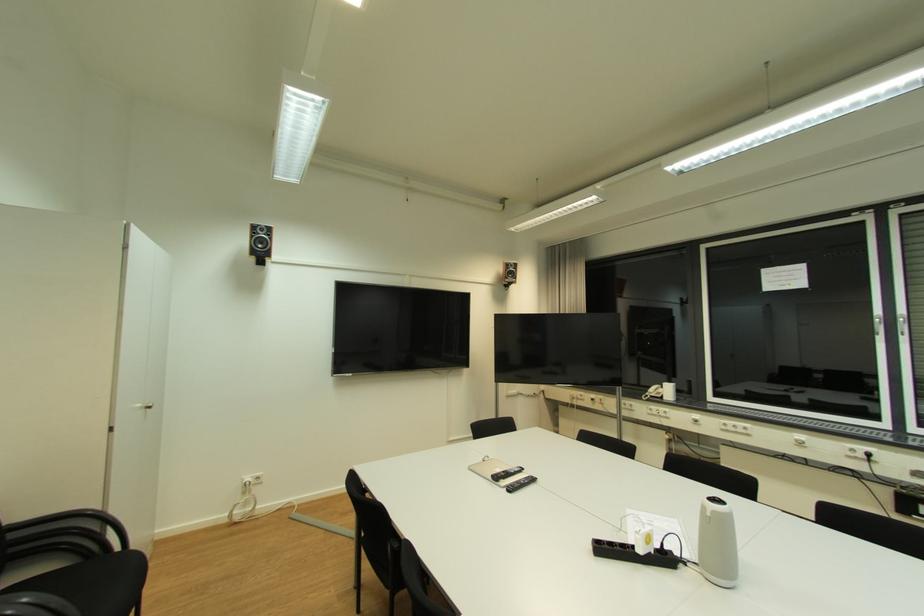
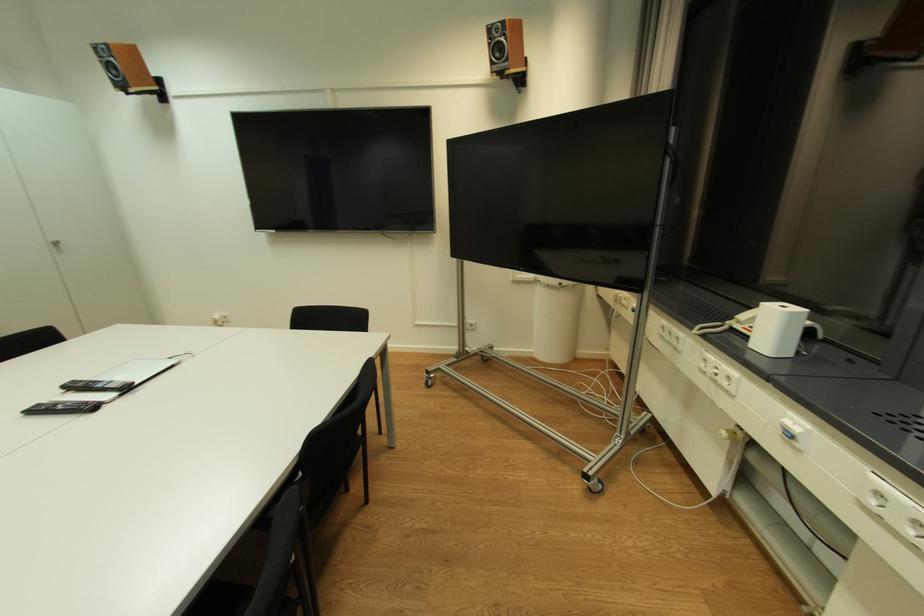
In the second image, find the point that corresponds to point 149,411 in the first image.

(57, 246)